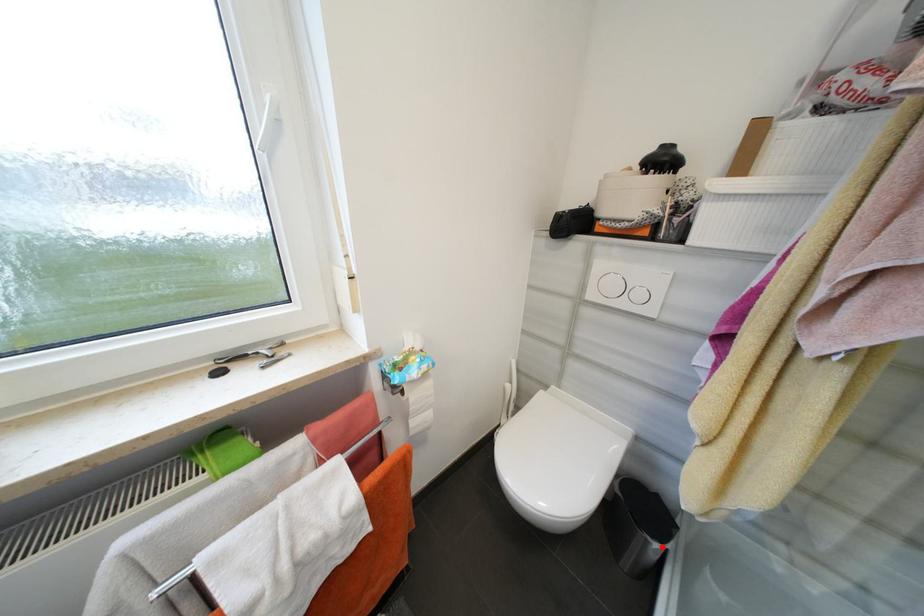
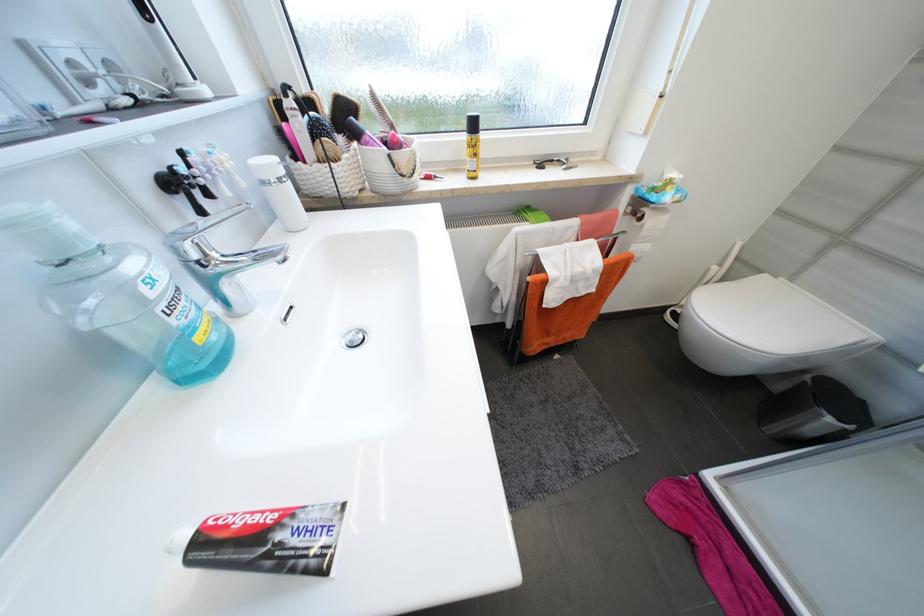
Find the pixel in the second image that matches the highlighted location in the first image.

(834, 421)